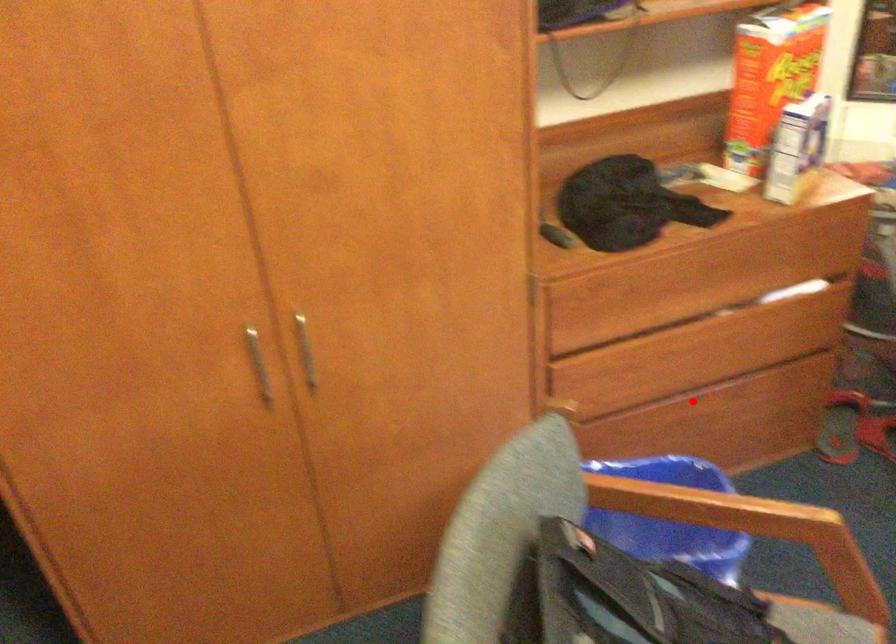
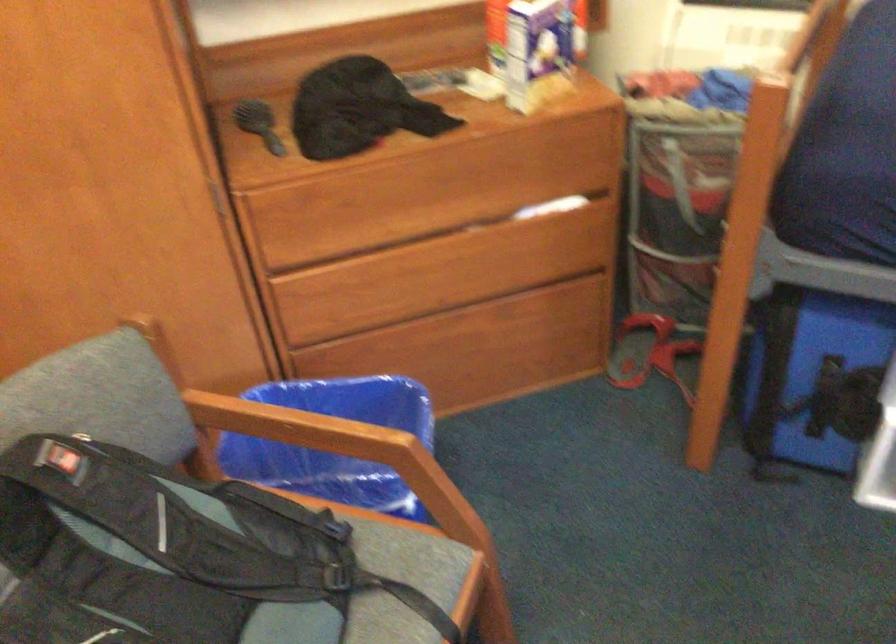
Locate, in the second image, the point that corresponds to the highlighted location in the first image.

(453, 319)